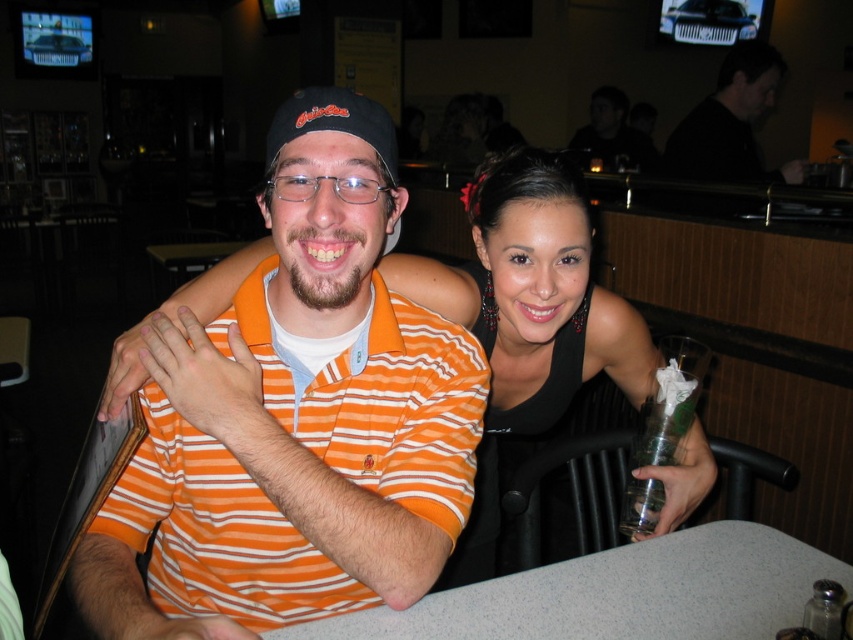
Can you confirm if gray speckled table at lower center is positioned above clear glass salt shaker at lower right?

No, gray speckled table at lower center is not above clear glass salt shaker at lower right.

This screenshot has width=853, height=640. What are the coordinates of `gray speckled table at lower center` in the screenshot? It's located at (619, 595).

Does orange striped polo shirt at center have a lesser width compared to clear glass salt shaker at lower right?

In fact, orange striped polo shirt at center might be wider than clear glass salt shaker at lower right.

The height and width of the screenshot is (640, 853). I want to click on orange striped polo shirt at center, so click(x=294, y=417).

The image size is (853, 640). What are the coordinates of `orange striped polo shirt at center` in the screenshot? It's located at (294, 417).

Between black matte shirt at upper right and dark matte shirt at upper right, which one has less height?

black matte shirt at upper right is shorter.

Which is above, black matte shirt at upper right or dark matte shirt at upper right?

Positioned higher is dark matte shirt at upper right.

You are a GUI agent. You are given a task and a screenshot of the screen. Output one action in this format:
    pyautogui.click(x=<x>, y=<y>)
    Task: Click on the black matte shirt at upper right
    Image resolution: width=853 pixels, height=640 pixels.
    Given the screenshot: What is the action you would take?
    pyautogui.click(x=730, y=122)

Where is `black matte shirt at upper right`? Image resolution: width=853 pixels, height=640 pixels. black matte shirt at upper right is located at coordinates (730, 122).